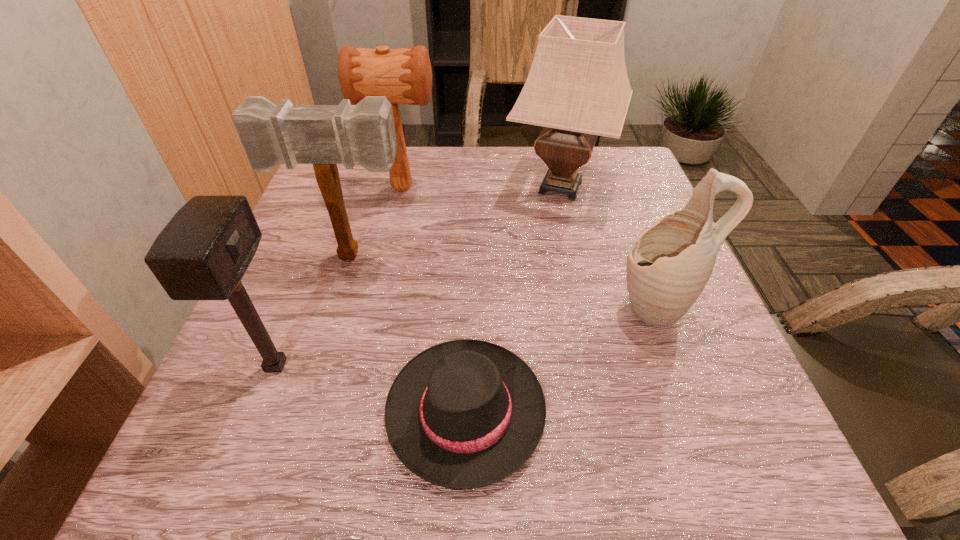
Where is `mallet that can be found as the closest to the farthest mallet`? Image resolution: width=960 pixels, height=540 pixels. mallet that can be found as the closest to the farthest mallet is located at coordinates (323, 135).

In order to click on free space in the image that satisfies the following two spatial constraints: 1. on the strike surface of the farthest mallet; 2. on the front side of the third farthest object in this screenshot , I will do `click(388, 255)`.

At what (x,y) coordinates should I click in order to perform the action: click on vacant position in the image that satisfies the following two spatial constraints: 1. on the strike surface of the shortest object; 2. on the right side of the farthest mallet. Please return your answer as a coordinate pair (x, y). Looking at the image, I should click on (353, 410).